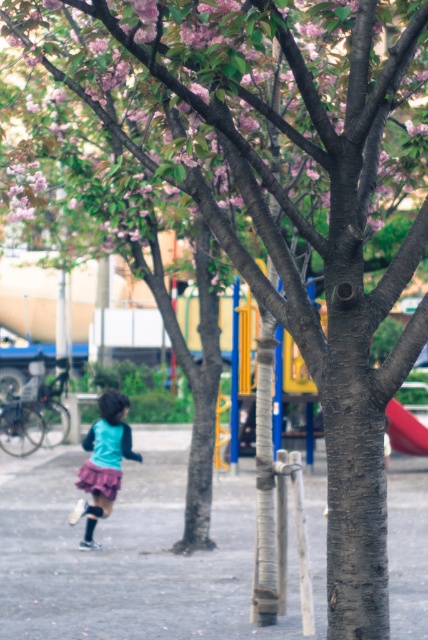
Does matte teal shirt at center have a greater height compared to smooth plastic slide at right?

Yes, matte teal shirt at center is taller than smooth plastic slide at right.

Which is behind, point (109, 476) or point (389, 429)?

Positioned behind is point (389, 429).

Is point (106, 444) farther from viewer compared to point (425, 428)?

No.

Identify the location of matte teal shirt at center. This screenshot has width=428, height=640. (104, 461).

Is pink matte flowers at upper left bigger than matte teal shirt at center?

No.

This screenshot has height=640, width=428. What do you see at coordinates (244, 90) in the screenshot?
I see `pink matte flowers at upper left` at bounding box center [244, 90].

Between point (297, 20) and point (86, 461), which one is positioned in front?

Point (297, 20) is more forward.

You are a GUI agent. You are given a task and a screenshot of the screen. Output one action in this format:
    pyautogui.click(x=<x>, y=<y>)
    Task: Click on the pink matte flowers at upper left
    This screenshot has width=428, height=640.
    Given the screenshot: What is the action you would take?
    pyautogui.click(x=244, y=90)

Consider the image. Which of these two, pink matte flowers at upper left or smooth plastic slide at right, stands taller?

With more height is smooth plastic slide at right.

Is pink matte flowers at upper left below smooth plastic slide at right?

Incorrect, pink matte flowers at upper left is not positioned below smooth plastic slide at right.

Between point (252, 13) and point (427, 444), which one is positioned in front?

Positioned in front is point (252, 13).

You are a GUI agent. You are given a task and a screenshot of the screen. Output one action in this format:
    pyautogui.click(x=<x>, y=<y>)
    Task: Click on the pink matte flowers at upper left
    This screenshot has height=640, width=428.
    Given the screenshot: What is the action you would take?
    pyautogui.click(x=244, y=90)